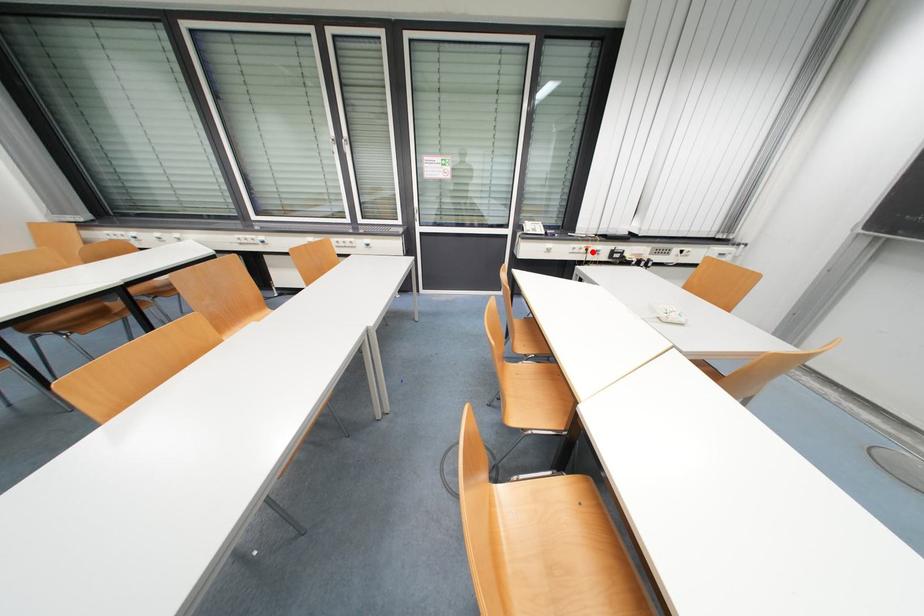
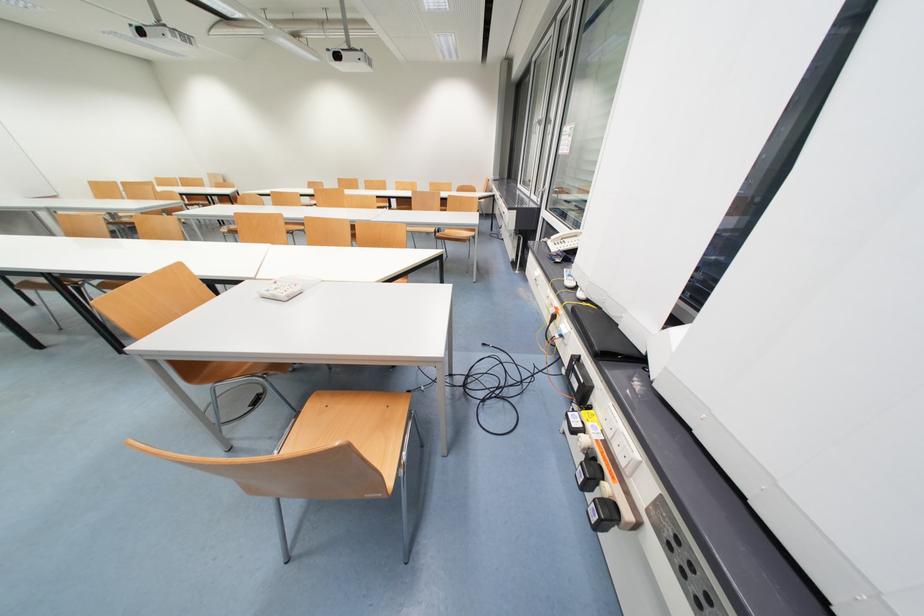
Where in the second image is the point corresponding to the highlighted location from the first image?

(560, 318)